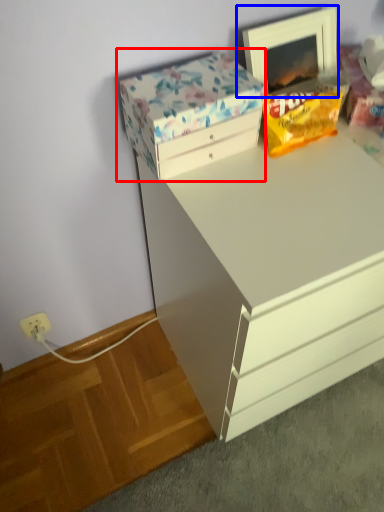
Question: Which point is further to the camera, storage box (highlighted by a red box) or picture frame (highlighted by a blue box)?

Choices:
 (A) storage box
 (B) picture frame

Answer: (B)